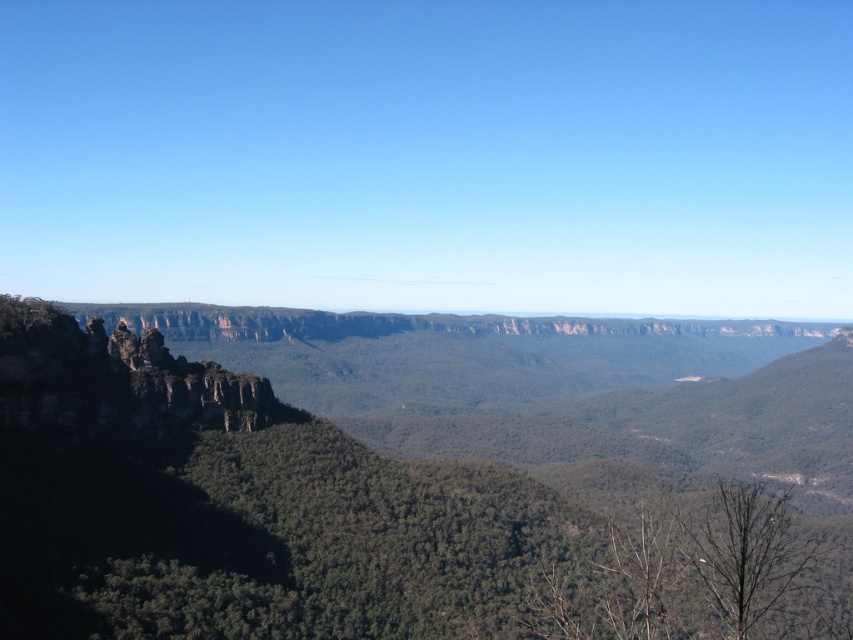
From the picture: You are a hiker planning to take a photo of the rugged rock formation at left and the rugged stone rock formation at left. Which one should you position closer to the camera to capture both in the frame?

The rugged rock formation at left is located below the rugged stone rock formation at left, so positioning the rugged rock formation at left closer to the camera would allow both to be captured in the frame since it is lower in the scene.

You are a hiker planning to cross the valley between the rugged rock formation at left and the rugged stone rock formation at left. Given that your average walking pace is 3 miles per hour, how long would it take you to traverse this distance?

The distance between the rugged rock formation at left and the rugged stone rock formation at left is 146.39 feet. Converting this to miles, it is approximately 0.0277 miles. At a pace of 3 miles per hour, the time required would be roughly 0.0277 miles divided by 3 mph, which equals approximately 0.0092 hours. Converting this to minutes, it would take roughly 0.55 minutes or about 33 seconds to cross the valley between the rugged rock formation at left and the rugged stone rock formation at left.